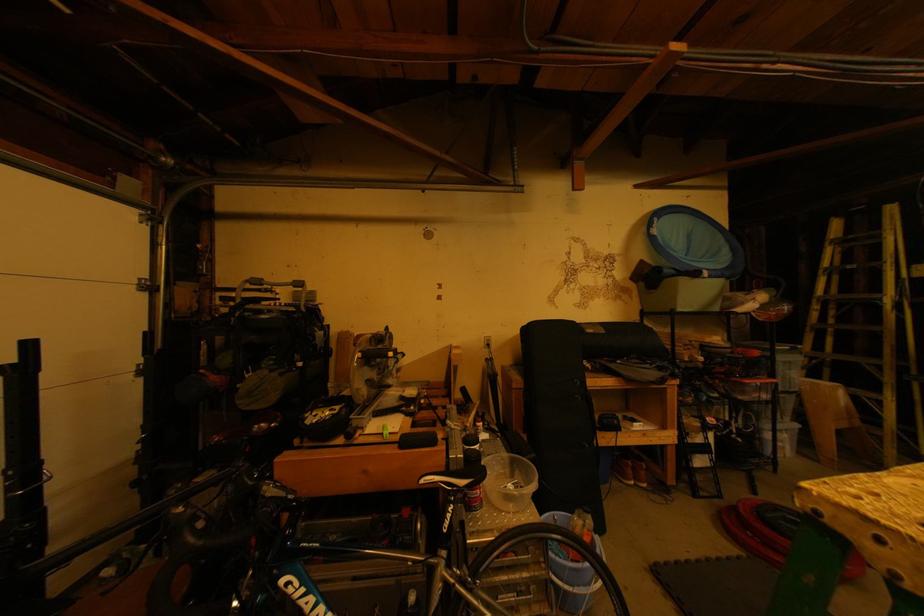
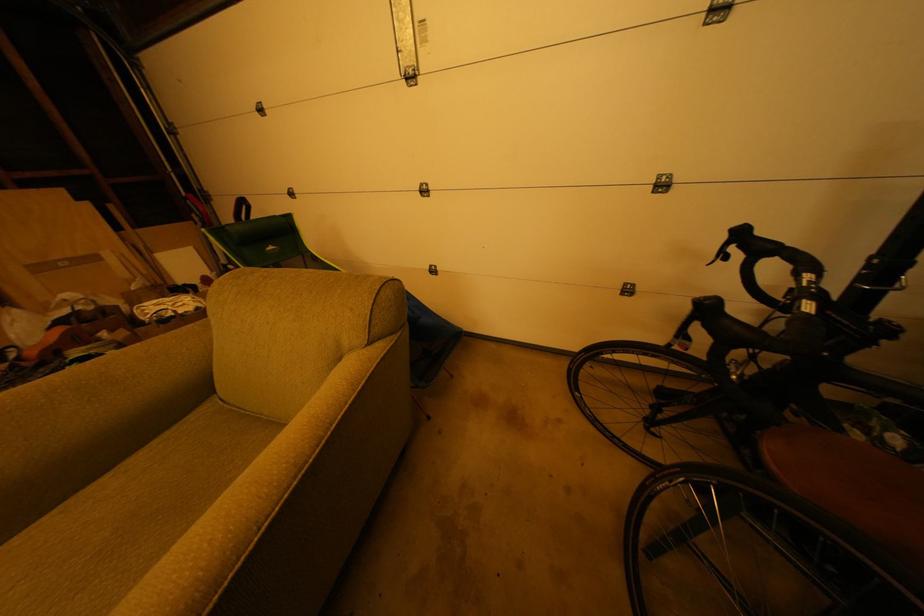
The images are taken continuously from a first-person perspective. In which direction is your viewpoint rotating?

The camera's rotation is toward left-down.